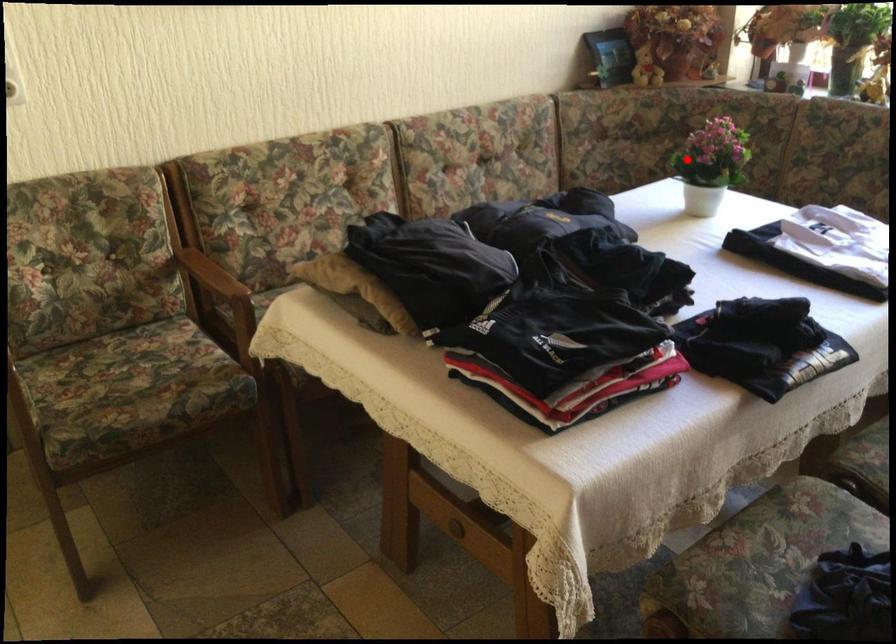
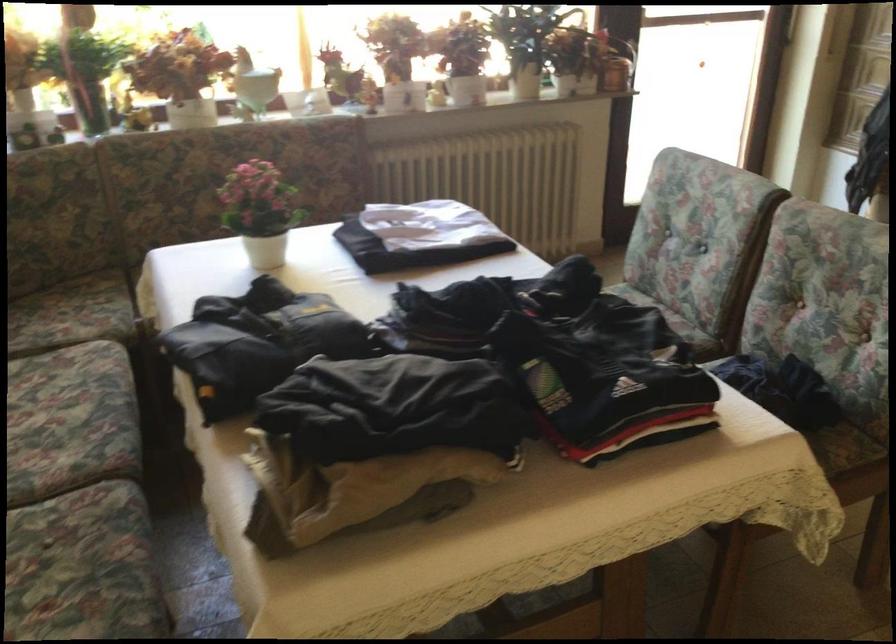
The point at the highlighted location is marked in the first image. Where is the corresponding point in the second image?

(261, 212)